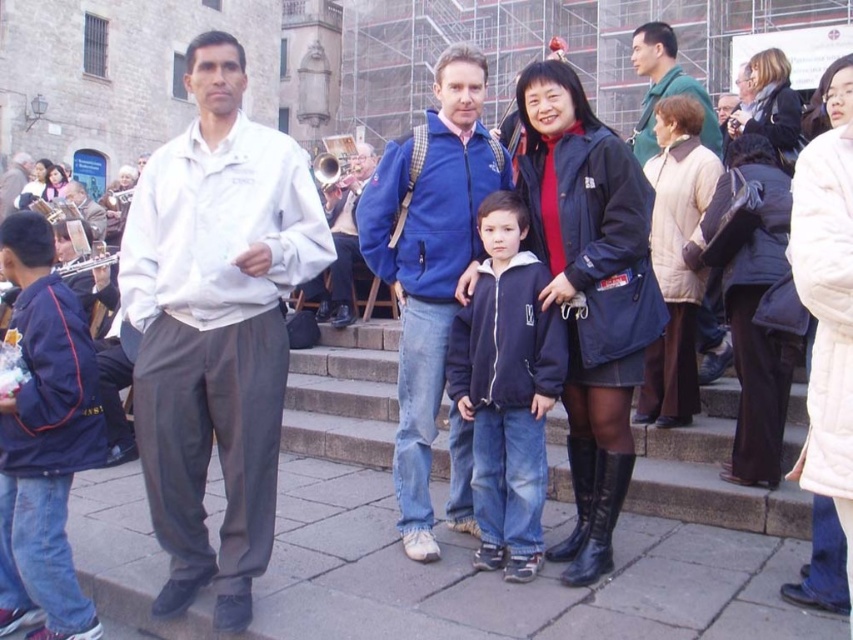
You are an event organizer trying to arrange seating for a group photo. You have two shirts to place on a rack. The white cotton shirt at left is smaller than the green fabric shirt at upper right. Which shirt should you place first to maximize space efficiency?

The white cotton shirt at left occupies less space than the green fabric shirt at upper right, so you should place the white cotton shirt at left first to maximize space efficiency.

Based on the photo, you are a photographer trying to capture a photo of the white cotton shirt at left and the green fabric shirt at upper right. The minimum distance your camera can focus clearly is 18 meters. Can you take a clear photo of both shirts at the same time?

The white cotton shirt at left is 19.05 meters from the green fabric shirt at upper right. Since the distance between them is greater than the camera minimum focus distance of 18 meters, the camera may not be able to focus clearly on both shirts simultaneously.

You are a photographer trying to adjust the composition of the image. You want to ensure that the green matte jacket at upper right and the green fabric shirt at upper right are both visible in the frame. Based on their positions, which one is closer to the bottom of the image?

The green matte jacket at upper right is located below the green fabric shirt at upper right, so it is closer to the bottom of the image.